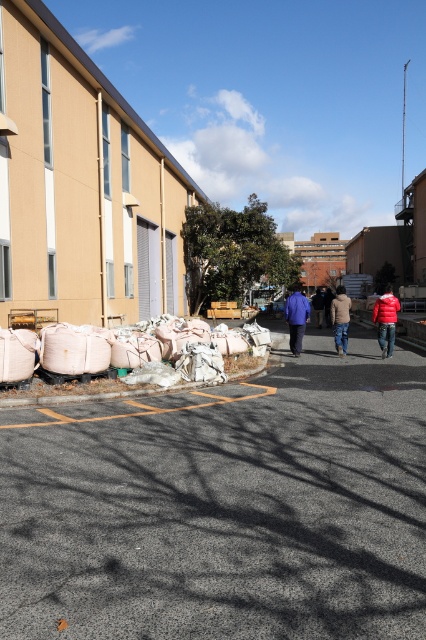
Question: Is gray asphalt pavement at lower center above white fabric sacks at lower left?

Choices:
 (A) no
 (B) yes

Answer: (A)

Question: Does white fabric sacks at lower left appear on the right side of red matte jacket at center?

Choices:
 (A) yes
 (B) no

Answer: (B)

Question: Which point is farther to the camera?

Choices:
 (A) (307, 492)
 (B) (316, 291)

Answer: (B)

Question: Which of these objects is positioned farthest from the red matte jacket at center?

Choices:
 (A) matte blue jacket at center
 (B) beige wool sweater at center
 (C) white fabric sacks at lower left
 (D) dark blue jacket at center

Answer: (D)

Question: Does white fabric sacks at lower left appear on the left side of red matte jacket at center?

Choices:
 (A) no
 (B) yes

Answer: (B)

Question: Which is farther from the beige wool sweater at center?

Choices:
 (A) red matte jacket at center
 (B) dark blue jacket at center
 (C) white fabric sacks at lower left
 (D) matte blue jacket at center

Answer: (B)